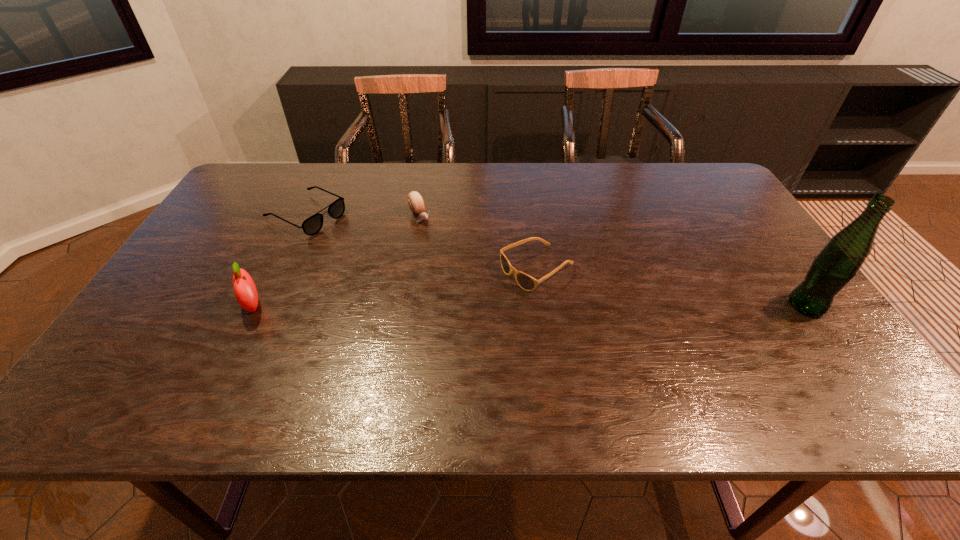
Find the location of `object positioned at the right edge`. object positioned at the right edge is located at coordinates (837, 264).

Locate an element on the screen. This screenshot has height=540, width=960. object present at the far left corner is located at coordinates (312, 225).

The height and width of the screenshot is (540, 960). In the image, there is a desktop. Find the location of `vacant area at the far edge`. vacant area at the far edge is located at coordinates (313, 185).

At what (x,y) coordinates should I click in order to perform the action: click on vacant position at the near edge of the desktop. Please return your answer as a coordinate pair (x, y). Looking at the image, I should click on (385, 350).

You are a GUI agent. You are given a task and a screenshot of the screen. Output one action in this format:
    pyautogui.click(x=<x>, y=<y>)
    Task: Click on the vacant area at the left edge of the desktop
    This screenshot has width=960, height=540.
    Given the screenshot: What is the action you would take?
    pyautogui.click(x=239, y=225)

Identify the location of free space at the right edge of the desktop. This screenshot has width=960, height=540. (774, 328).

Find the location of a particular element. Image resolution: width=960 pixels, height=540 pixels. free space at the far left corner is located at coordinates (273, 198).

I want to click on vacant space that is in between the third tallest object and the rightmost object, so click(613, 261).

Locate an element on the screen. This screenshot has height=540, width=960. unoccupied area between the spectacles and the beer bottle is located at coordinates point(557,260).

I want to click on free space between the apple and the rightmost object, so click(x=530, y=306).